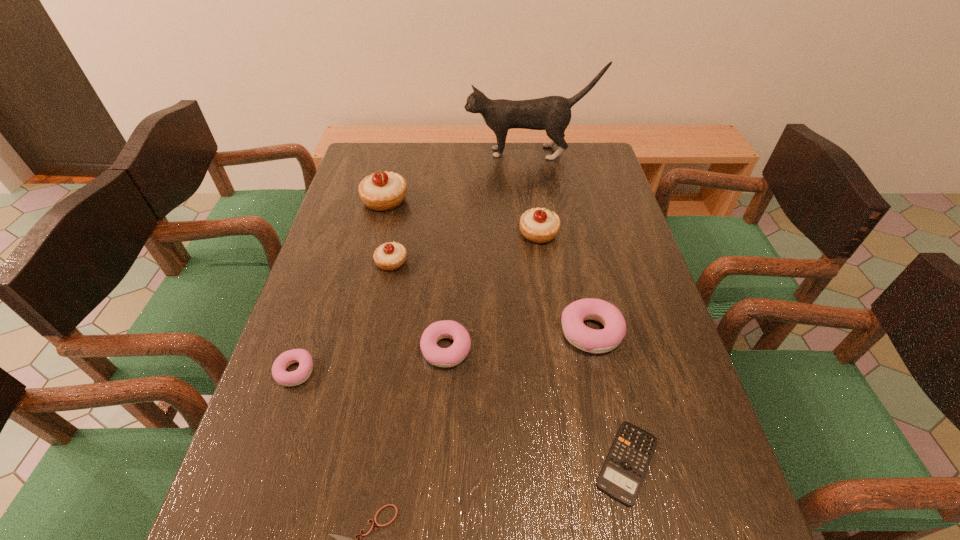
Identify the location of the farthest object. This screenshot has height=540, width=960. point(552,113).

Locate an element on the screen. cat is located at coordinates (552, 113).

Find the location of a particular element. the farthest beige pastry is located at coordinates (381, 191).

The width and height of the screenshot is (960, 540). In order to click on the farthest pastry in this screenshot , I will do `click(381, 191)`.

Identify the location of the third farthest object. This screenshot has height=540, width=960. (539, 225).

At what (x,y) coordinates should I click in order to perform the action: click on the second tallest pastry. Please return your answer as a coordinate pair (x, y). Image resolution: width=960 pixels, height=540 pixels. Looking at the image, I should click on (539, 225).

Locate an element on the screen. The width and height of the screenshot is (960, 540). the smallest beige pastry is located at coordinates (390, 256).

Where is `the fourth farthest object`? the fourth farthest object is located at coordinates (390, 256).

Find the location of a particular element. the fourth tallest pastry is located at coordinates (576, 332).

Locate an element on the screen. The height and width of the screenshot is (540, 960). the fifth tallest object is located at coordinates (576, 332).